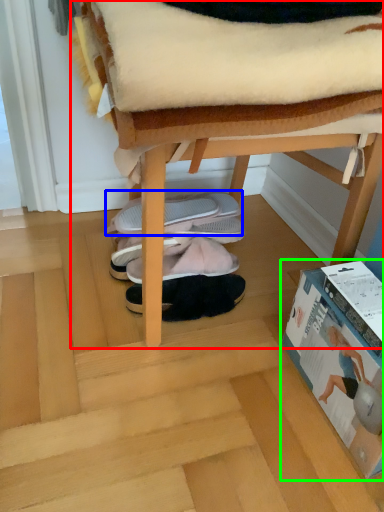
Question: Considering the real-world distances, which object is farthest from furniture (highlighted by a red box)? footwear (highlighted by a blue box) or paperback book (highlighted by a green box)?

Choices:
 (A) footwear
 (B) paperback book

Answer: (A)